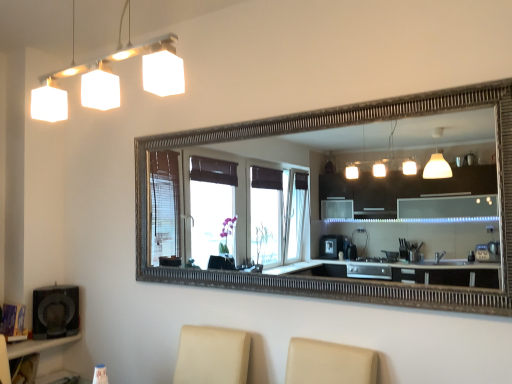
Question: In the image, is matte black speaker at lower left positioned in front of or behind white matte square light fixture at upper left?

Choices:
 (A) front
 (B) behind

Answer: (B)

Question: From the image's perspective, relative to white matte square light fixture at upper left, is matte black speaker at lower left above or below?

Choices:
 (A) above
 (B) below

Answer: (B)

Question: Which object is positioned closest to the matte black speaker at lower left?

Choices:
 (A) matte black shelf at lower left
 (B) white matte square light fixture at upper left

Answer: (A)

Question: Estimate the real-world distances between objects in this image. Which object is farther from the white matte square light fixture at upper left?

Choices:
 (A) matte black shelf at lower left
 (B) matte black speaker at lower left

Answer: (A)